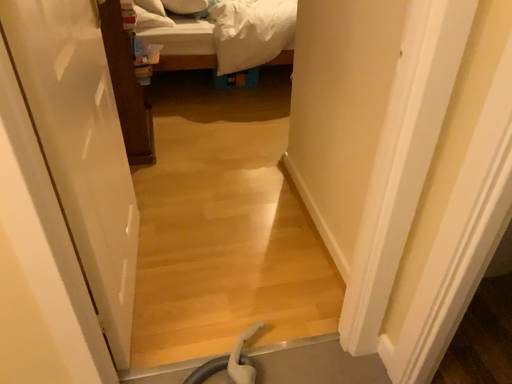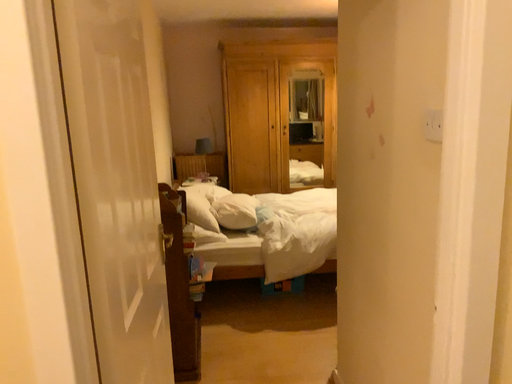
Question: How did the camera likely rotate when shooting the video?

Choices:
 (A) rotated downward
 (B) rotated upward

Answer: (B)